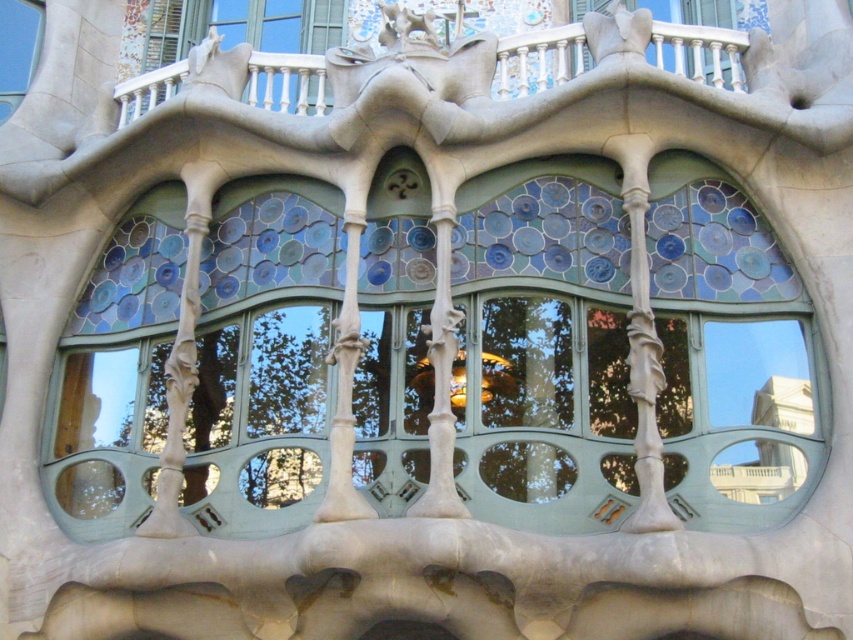
You are an architect reviewing a design plan for a building with intricate windows. You notice the blue mosaic glass at center and the stained glass window at upper left. According to the design, which object is positioned lower in the structure?

The blue mosaic glass at center is positioned below the stained glass window at upper left, so it is lower in the structure.

Looking at this image, you are an architect evaluating the building facade. You notice the smooth stone balcony at upper center and the stained glass window at upper left. Which of these two elements has a greater height?

The stained glass window at upper left has a greater height than the smooth stone balcony at upper center.

You are standing in front of the building and want to determine the relative positions of two points on its facade. The first point is labeled as point (x=566, y=483) and the second is point (x=503, y=84). Based on the architectural details provided, which point is situated closer to you?

Point (x=566, y=483) is closer to the viewer than point (x=503, y=84).